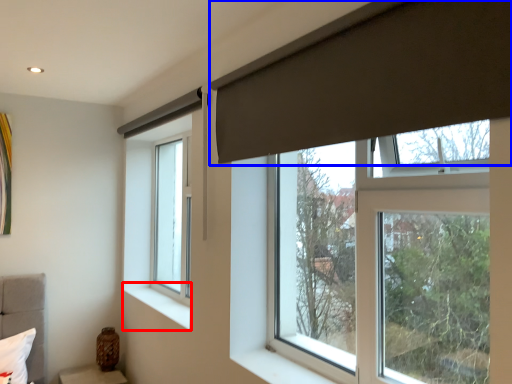
Question: Which point is closer to the camera, window sill (highlighted by a red box) or curtain (highlighted by a blue box)?

Choices:
 (A) window sill
 (B) curtain

Answer: (B)